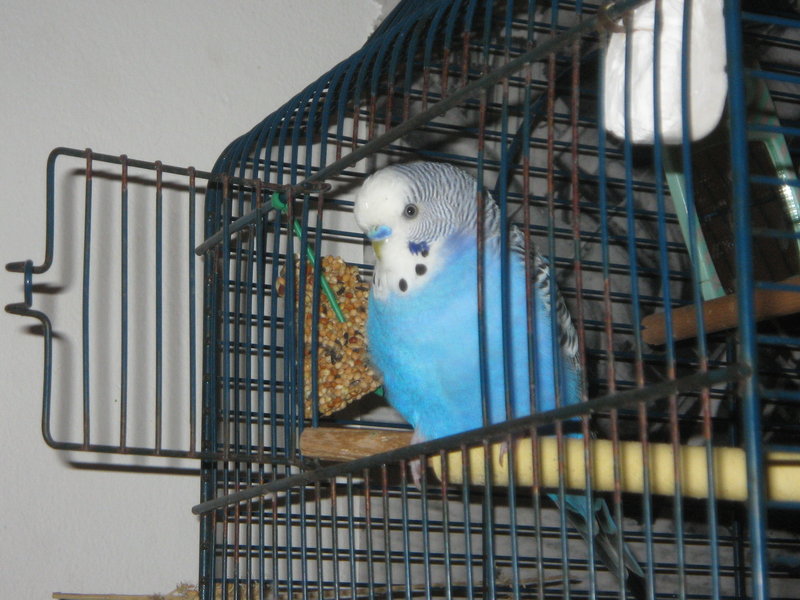
The image size is (800, 600). Find the location of `door`. door is located at coordinates (198, 319).